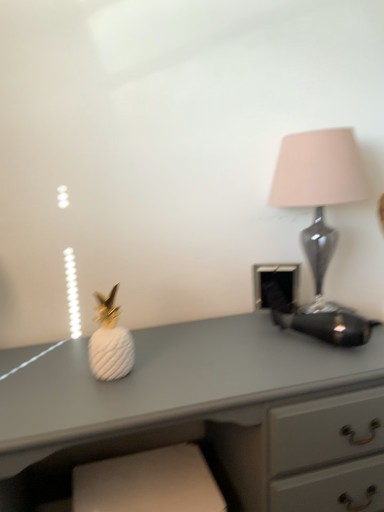
Where is `empty space that is to the right of white matte pineapple at center`? This screenshot has height=512, width=384. empty space that is to the right of white matte pineapple at center is located at coordinates (177, 368).